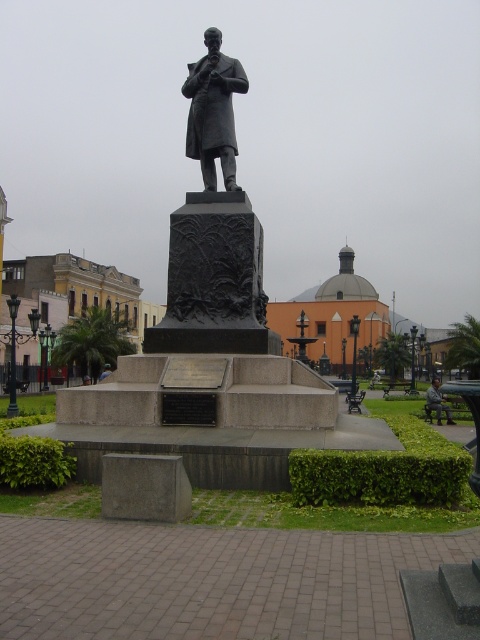
Does polished bronze statue at center have a smaller size compared to camouflage fabric jacket at lower right?

Indeed, polished bronze statue at center has a smaller size compared to camouflage fabric jacket at lower right.

Can you confirm if polished bronze statue at center is positioned above camouflage fabric jacket at lower right?

Yes, polished bronze statue at center is above camouflage fabric jacket at lower right.

Is point (183, 220) closer to camera compared to point (445, 397)?

Yes, point (183, 220) is in front of point (445, 397).

This screenshot has height=640, width=480. In order to click on polished bronze statue at center in this screenshot , I will do `click(214, 230)`.

Does point (216, 236) come in front of point (210, 172)?

Yes.

Does point (227, 86) come behind point (232, 138)?

That is False.

I want to click on polished bronze statue at center, so click(214, 230).

Can you confirm if bronze statue at center is thinner than camouflage fabric jacket at lower right?

Yes, bronze statue at center is thinner than camouflage fabric jacket at lower right.

This screenshot has width=480, height=640. I want to click on bronze statue at center, so click(214, 112).

Is point (217, 74) farther from camera compared to point (437, 387)?

No, (217, 74) is closer to viewer.

Locate an element on the screen. The width and height of the screenshot is (480, 640). bronze statue at center is located at coordinates (214, 112).